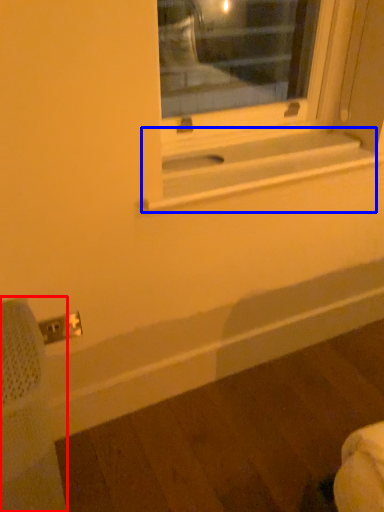
Question: Among these objects, which one is nearest to the camera, swivel chair (highlighted by a red box) or window sill (highlighted by a blue box)?

Choices:
 (A) swivel chair
 (B) window sill

Answer: (A)